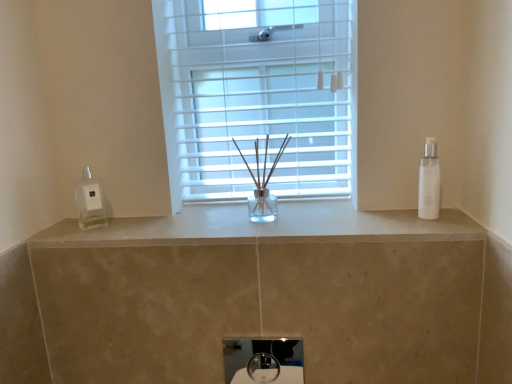
This screenshot has width=512, height=384. Describe the element at coordinates (429, 182) in the screenshot. I see `white glossy bottle at right` at that location.

Describe the element at coordinates (90, 202) in the screenshot. I see `white glossy soap dispenser at left` at that location.

What do you see at coordinates (256, 95) in the screenshot?
I see `white plastic window at center` at bounding box center [256, 95].

I want to click on white glossy bottle at right, so click(429, 182).

Does point (435, 157) come farther from viewer compared to point (249, 190)?

No.

Is the position of white glossy bottle at right more distant than that of white plastic window at center?

No.

From the image's perspective, is white glossy bottle at right below white plastic window at center?

Yes.

Is white glossy sink at center facing away from white marble counter at center?

No, white glossy sink at center is not facing the opposite direction of white marble counter at center.

Is white glossy sink at center next to white marble counter at center and touching it?

No, white glossy sink at center is not making contact with white marble counter at center.

Considering the sizes of objects white glossy sink at center and white marble counter at center in the image provided, who is wider, white glossy sink at center or white marble counter at center?

white marble counter at center.

Does point (251, 373) lie in front of point (128, 222)?

No, (251, 373) is behind (128, 222).

In the image, there is a white marble counter at center. Identify the location of window above it (from the image's perspective). (256, 95).

Considering the sizes of objects white marble counter at center and white plastic window at center in the image provided, who is wider, white marble counter at center or white plastic window at center?

With larger width is white marble counter at center.

From a real-world perspective, is white marble counter at center positioned above or below white plastic window at center?

white marble counter at center is below white plastic window at center.

What's the angular difference between white plastic window at center and white marble counter at center's facing directions?

white plastic window at center and white marble counter at center are facing 0.683 degrees away from each other.

Is white plastic window at center with white marble counter at center?

They are not placed beside each other.

In order to click on counter top in front of the white plastic window at center in this screenshot , I will do `click(264, 227)`.

Is white plastic window at center located outside white marble counter at center?

That's correct, white plastic window at center is outside of white marble counter at center.

Is white glossy sink at center taller than white glossy bottle at right?

No, white glossy sink at center is not taller than white glossy bottle at right.

Is white glossy sink at center thinner than white glossy bottle at right?

Yes, white glossy sink at center is thinner than white glossy bottle at right.

Looking at this image, is white glossy sink at center in front of or behind white glossy bottle at right in the image?

Visually, white glossy sink at center is located behind white glossy bottle at right.

Is white glossy bottle at right at the back of white glossy sink at center?

That's not correct — white glossy sink at center is not looking away from white glossy bottle at right.

What's the angular difference between white marble counter at center and white glossy soap dispenser at left's facing directions?

45.1 degrees separate the facing orientations of white marble counter at center and white glossy soap dispenser at left.

Is white marble counter at center turned away from white glossy soap dispenser at left?

white marble counter at center is not turned away from white glossy soap dispenser at left.

Is white marble counter at center positioned beyond the bounds of white glossy soap dispenser at left?

Yes.

From the image's perspective, does white marble counter at center appear higher than white glossy soap dispenser at left?

No, from the image's perspective, white marble counter at center is not above white glossy soap dispenser at left.

Identify the location of soap dispenser that appears in front of the white plastic window at center. (90, 202).

Considering the relative sizes of white plastic window at center and white glossy soap dispenser at left in the image provided, is white plastic window at center bigger than white glossy soap dispenser at left?

Yes, white plastic window at center is bigger than white glossy soap dispenser at left.

Does point (190, 86) come closer to viewer compared to point (98, 227)?

No, (190, 86) is further to viewer.

Identify the location of window that is behind the white glossy bottle at right. (256, 95).

This screenshot has width=512, height=384. What are the coordinates of `sink that is under the white marble counter at center (from a real-world perspective)` in the screenshot? It's located at (263, 361).

Estimate the real-world distances between objects in this image. Which object is closer to white glossy bottle at right, white glossy soap dispenser at left or white plastic window at center?

white plastic window at center lies closer to white glossy bottle at right than the other object.

In the scene shown: Which object lies nearer to the anchor point white marble counter at center, white plastic window at center or white glossy soap dispenser at left?

white plastic window at center.

From the image, which object appears to be farther from white marble counter at center, white glossy sink at center or white glossy bottle at right?

Based on the image, white glossy sink at center appears to be further to white marble counter at center.

Considering their positions, is white glossy soap dispenser at left positioned further to white glossy sink at center than white plastic window at center?

white glossy soap dispenser at left lies further to white glossy sink at center than the other object.

Looking at the image, which one is located further to white glossy sink at center, white marble counter at center or white glossy bottle at right?

white glossy bottle at right is positioned further to the anchor white glossy sink at center.

When comparing their distances from white glossy sink at center, does white glossy soap dispenser at left or white glossy bottle at right seem further?

The object further to white glossy sink at center is white glossy bottle at right.

Consider the image. Based on their spatial positions, is white glossy sink at center or white glossy bottle at right closer to white plastic window at center?

The object closer to white plastic window at center is white glossy bottle at right.

In the scene shown: Considering their positions, is white plastic window at center positioned closer to white glossy bottle at right than white marble counter at center?

white marble counter at center lies closer to white glossy bottle at right than the other object.

Locate an element on the screen. This screenshot has height=384, width=512. counter top between white glossy soap dispenser at left and white glossy bottle at right in the horizontal direction is located at coordinates (264, 227).

Locate an element on the screen. Image resolution: width=512 pixels, height=384 pixels. soap dispenser between white plastic window at center and white glossy sink at center vertically is located at coordinates (90, 202).

This screenshot has width=512, height=384. Find the location of `counter top between white glossy soap dispenser at left and white glossy sink at center`. counter top between white glossy soap dispenser at left and white glossy sink at center is located at coordinates (264, 227).

Where is `counter top between white plastic window at center and white glossy sink at center in the up-down direction`? counter top between white plastic window at center and white glossy sink at center in the up-down direction is located at coordinates (264, 227).